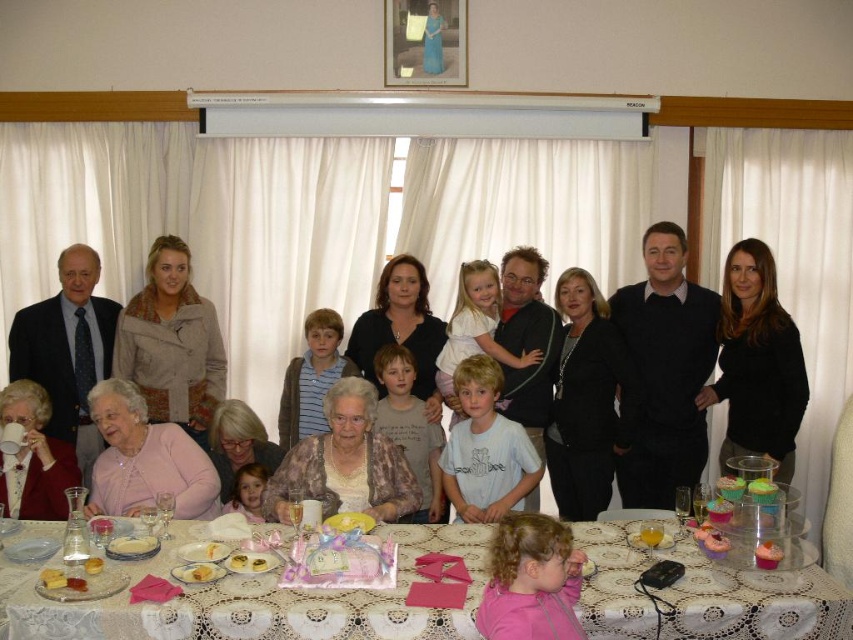
You are a photographer at the event and need to decide which garment to focus on for a closeup shot. Since the beige textured jacket at upper left and the white cotton shirt at center are both in view, which one would require a wider angle to capture fully?

The beige textured jacket at upper left is bigger than the white cotton shirt at center, so it would require a wider angle to capture fully.

You are a guest at this family gathering and need to place your matte black mug at lower left on the white lace tablecloth at lower center. Can you fit it without overlapping the edges?

The white lace tablecloth at lower center is wider than the matte black mug at lower left, so yes, you can place the matte black mug at lower left on the tablecloth without overlapping the edges.